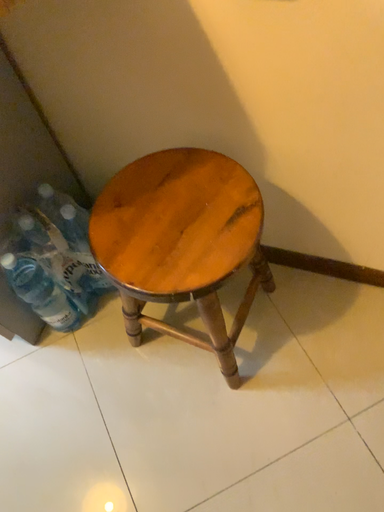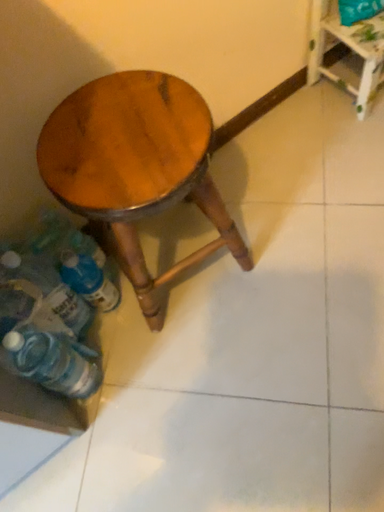
Question: How did the camera likely rotate when shooting the video?

Choices:
 (A) rotated right
 (B) rotated left

Answer: (A)